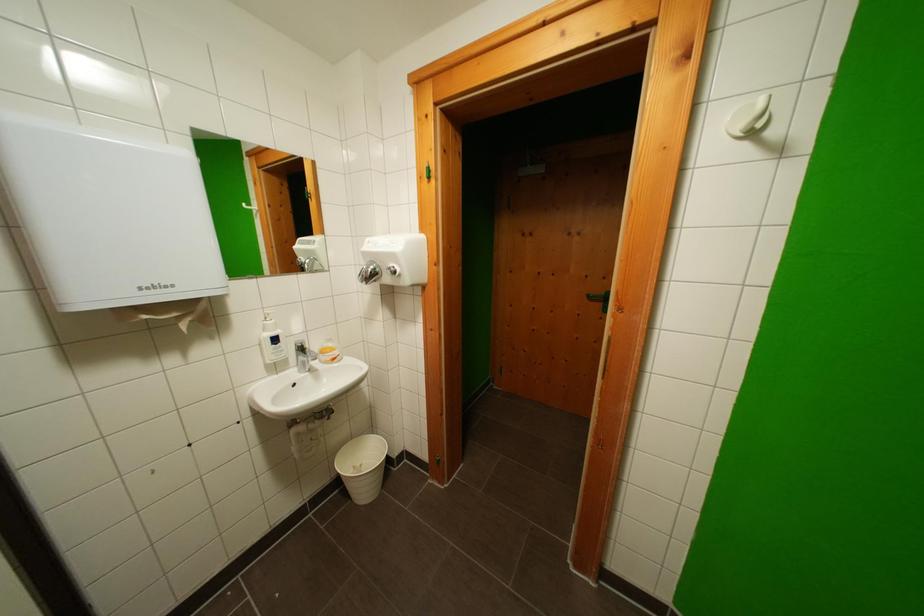
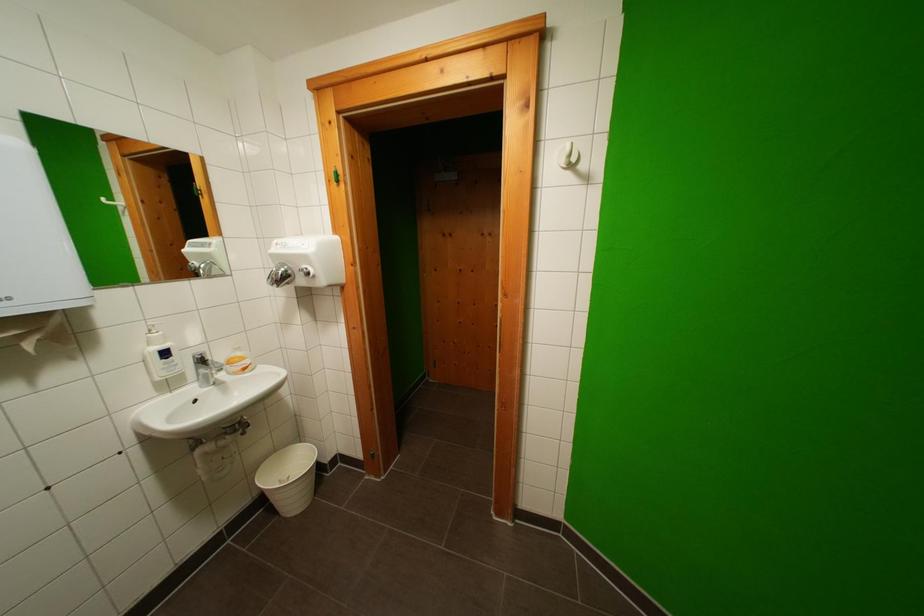
Find the pixel in the second image that matches pixel 371 496 in the first image.

(301, 507)